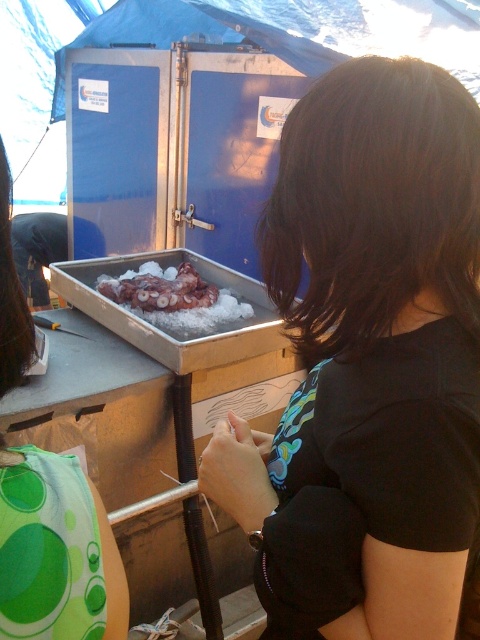
Based on the photo, you are a photographer setting up for an event. You need to place two markers at the coordinates point (425, 620) and point (156, 307). Since you want the marker closer to the camera to be more visible, which coordinate should you place the larger marker on?

Point (425, 620) is closer to the camera than point (156, 307), so you should place the larger marker on point (425, 620) to ensure it is more visible.

You are at the event and want to locate the black matte shirt at center. According to the coordinates provided, where should you look?

The black matte shirt at center is located at point coordinates (368,362).